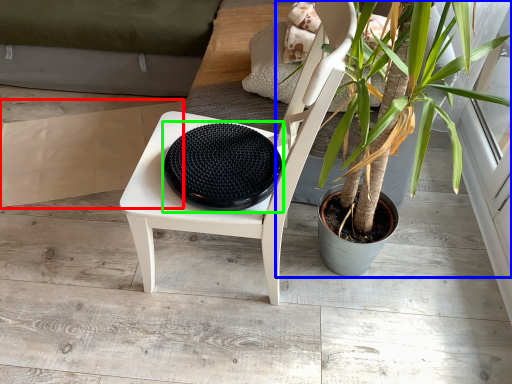
Question: Based on their relative distances, which object is farther from cardboard (highlighted by a red box)? Choose from houseplant (highlighted by a blue box) and manhole cover (highlighted by a green box).

Choices:
 (A) houseplant
 (B) manhole cover

Answer: (A)